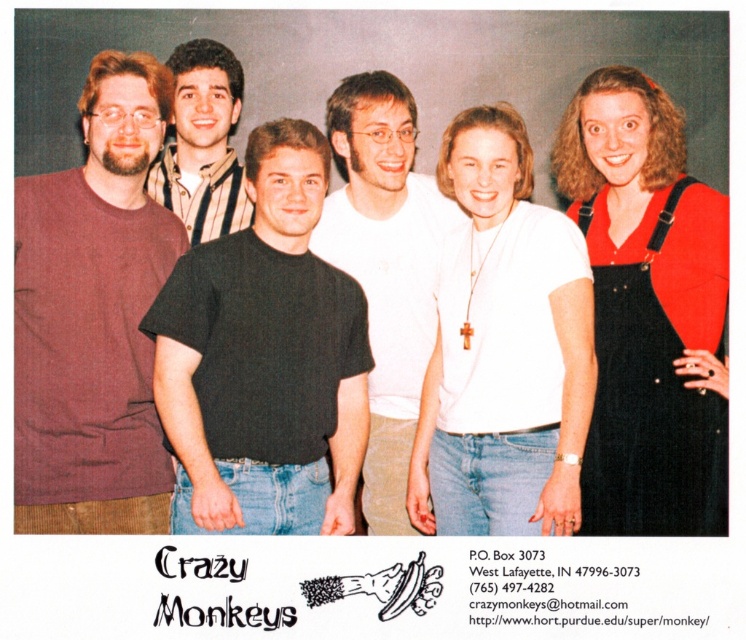
You are standing in front of the group photo. There is a point marked at coordinates (93, 316). Which object from the scene does this point lie on?

The point at coordinates (93, 316) is on the maroon t shirt at left.